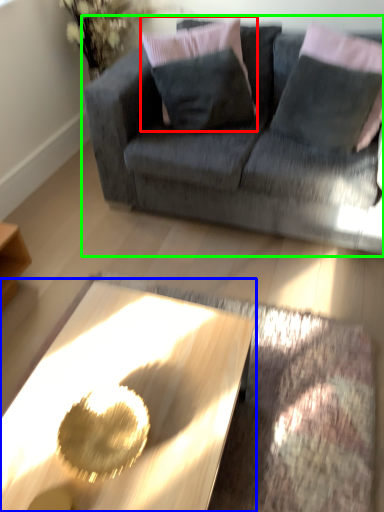
Question: Based on their relative distances, which object is nearer to pillow (highlighted by a red box)? Choose from coffee table (highlighted by a blue box) and studio couch (highlighted by a green box).

Choices:
 (A) coffee table
 (B) studio couch

Answer: (B)